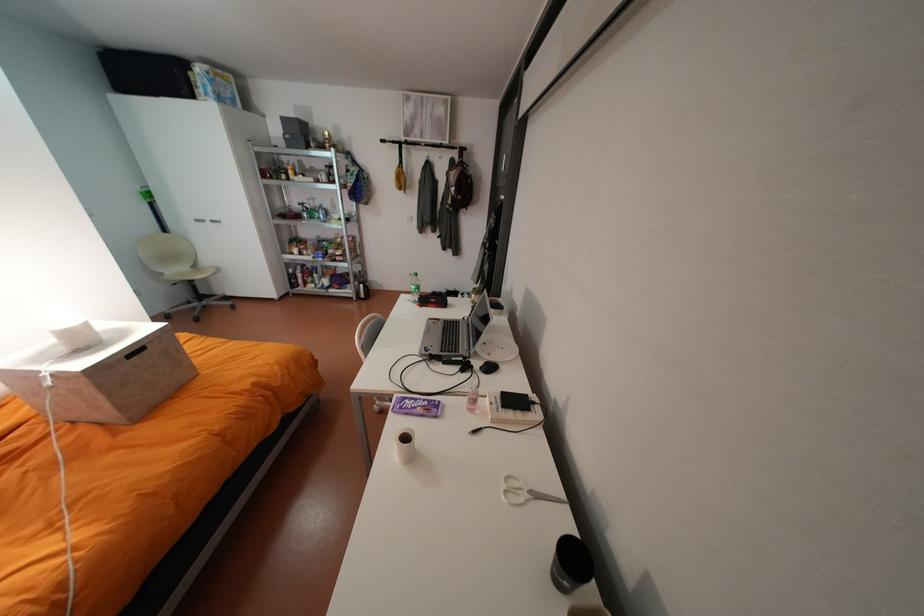
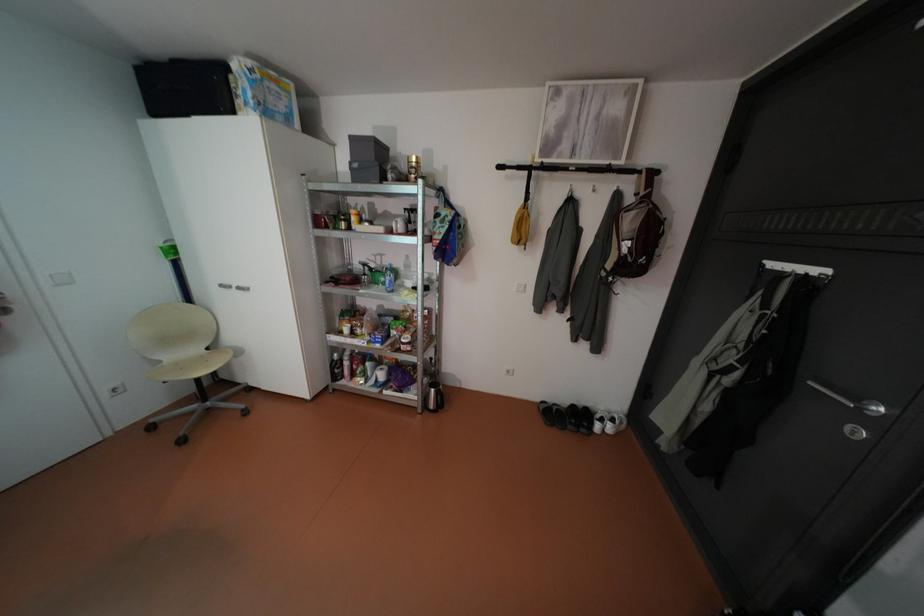
Locate, in the second image, the point that corresponds to pixel 237 92 in the first image.

(290, 107)